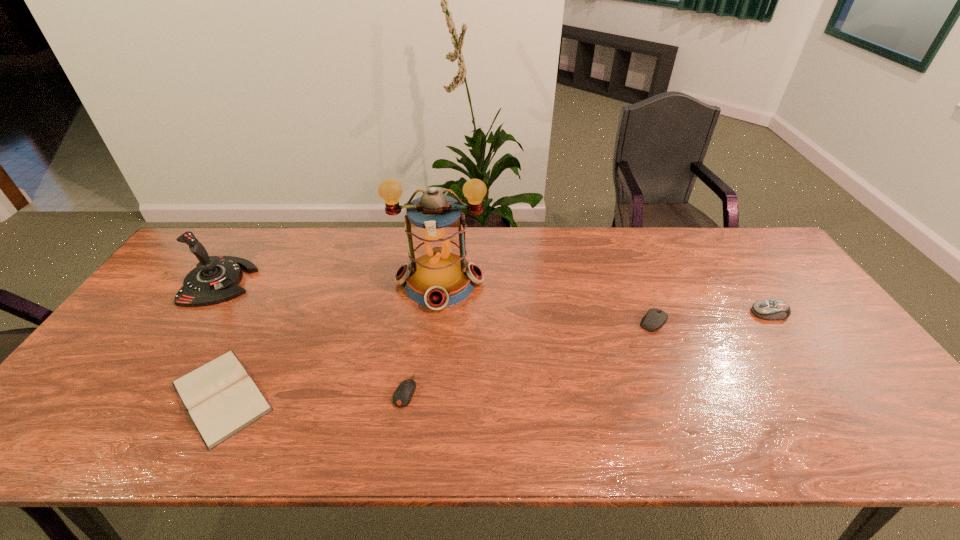
Locate an element on the screen. The width and height of the screenshot is (960, 540). the tallest object is located at coordinates (439, 275).

Identify the location of the fifth shortest object. Image resolution: width=960 pixels, height=540 pixels. (215, 279).

You are a GUI agent. You are given a task and a screenshot of the screen. Output one action in this format:
    pyautogui.click(x=<x>, y=<y>)
    Task: Click on the rightmost computer mouse
    The width and height of the screenshot is (960, 540).
    Given the screenshot: What is the action you would take?
    pyautogui.click(x=766, y=309)

Find the location of a particular element. The image size is (960, 540). the rightmost object is located at coordinates (766, 309).

Identify the location of the second computer mouse from left to right. pos(655,318).

Find the location of a particular element. This screenshot has height=540, width=960. the leftmost computer mouse is located at coordinates (403, 394).

The width and height of the screenshot is (960, 540). Identify the location of Bible. (221, 398).

This screenshot has height=540, width=960. I want to click on vacant region located on the front-facing side of the lantern, so click(x=426, y=410).

Locate an element on the screen. vacant space located 0.370m on the handle side of the joystick is located at coordinates (373, 282).

This screenshot has width=960, height=540. I want to click on free spot located on the wheel side of the tallest computer mouse, so click(x=618, y=313).